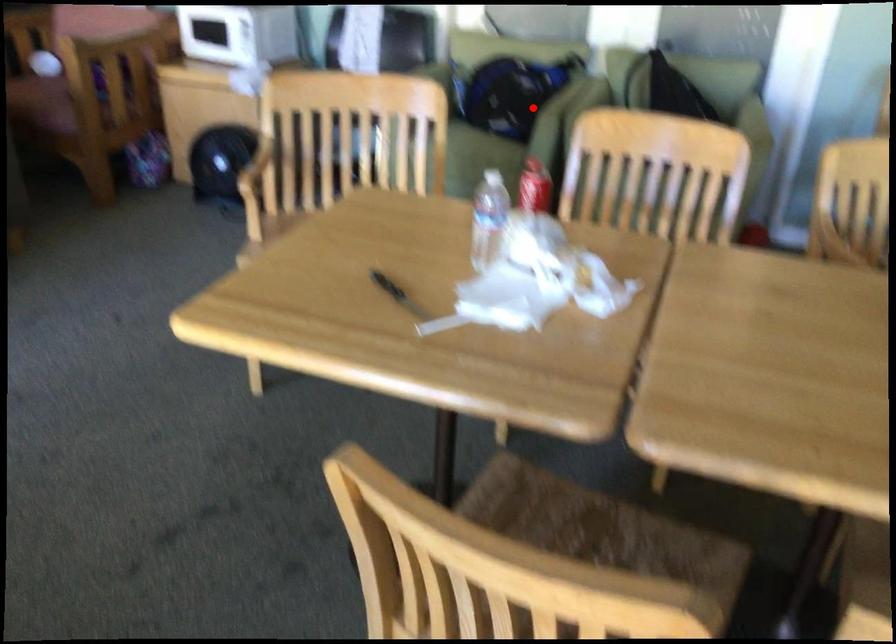
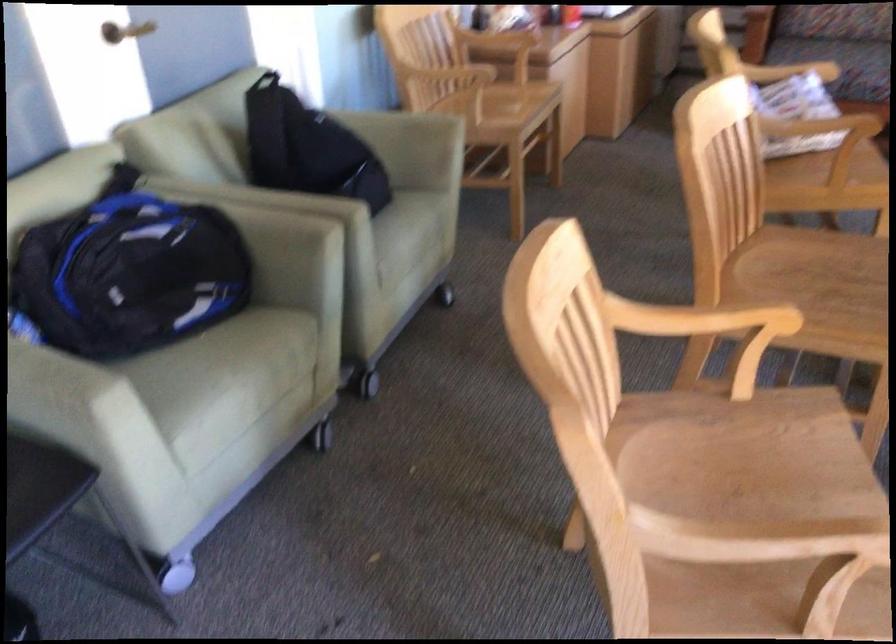
Find the pixel in the second image that matches the highlighted location in the first image.

(289, 232)